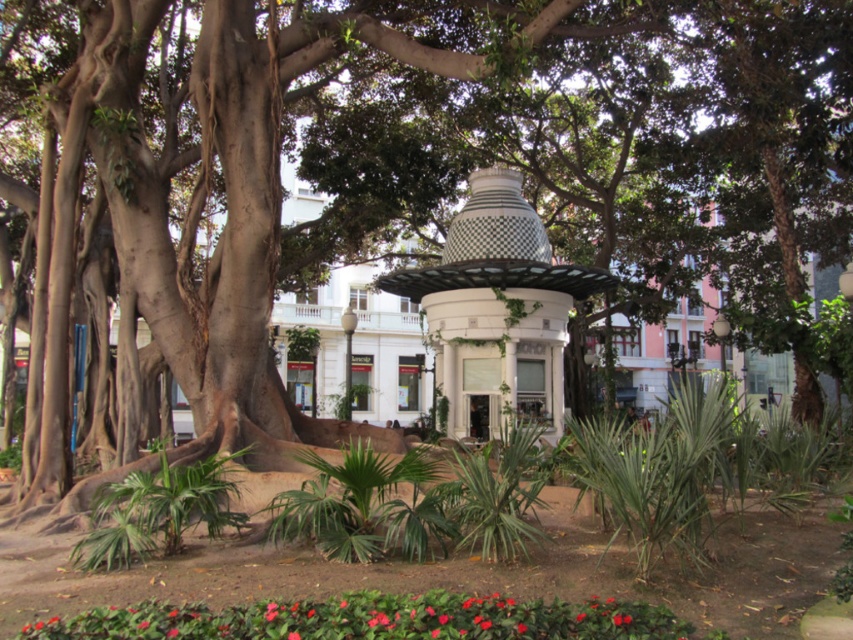
You are standing in the park and see two points marked in the image. Which point is closer to you, point (x=485, y=234) or point (x=144, y=602)?

Point (x=485, y=234) is further to the viewer than point (x=144, y=602), so point (x=144, y=602) is closer to you.

You are a gardener who wants to place a new plant pot between the white mosaic gazebo at center and the smooth glossy red flower at lower center. Based on their positions, which side of the flower should the pot be placed to ensure it is between them?

The white mosaic gazebo at center is positioned on the right side of smooth glossy red flower at lower center, so to place the pot between them, it should be placed to the right of the smooth glossy red flower at lower center.